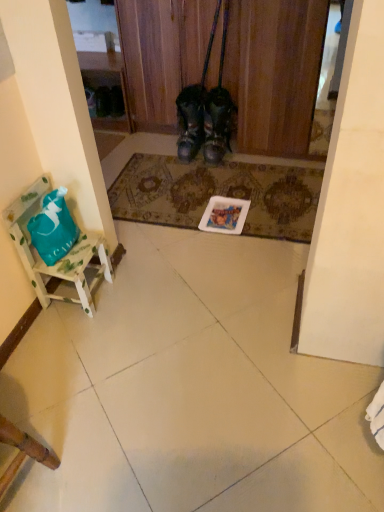
Image resolution: width=384 pixels, height=512 pixels. Identify the location of vacant area that lies between wooden chair at lower left and white wood chair at left. (56, 369).